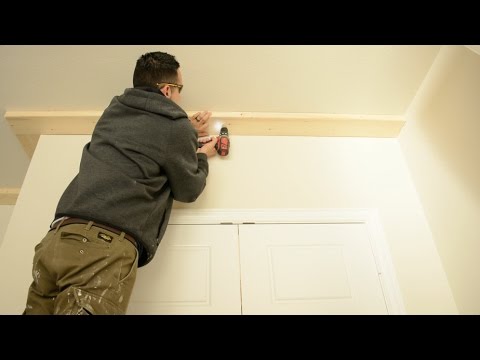
Where is `board`? Image resolution: width=480 pixels, height=360 pixels. board is located at coordinates [54, 123].